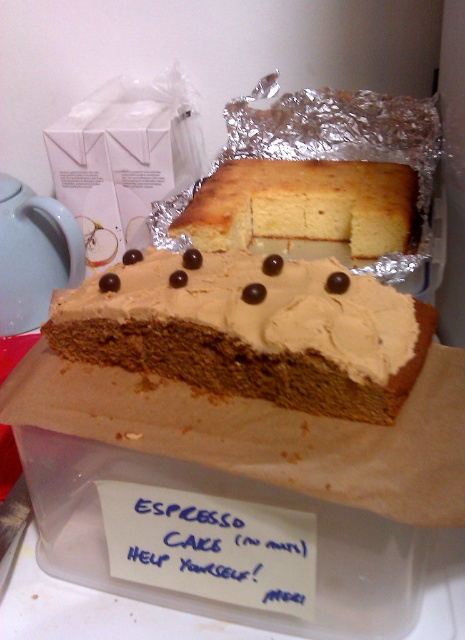
Who is positioned more to the right, brown matte cake at center or yellow sponge cake at center?

yellow sponge cake at center is more to the right.

Which is behind, point (387, 364) or point (407, 186)?

Positioned behind is point (407, 186).

What do you see at coordinates (252, 330) in the screenshot? The image size is (465, 640). I see `brown matte cake at center` at bounding box center [252, 330].

At what (x,y) coordinates should I click in order to perform the action: click on brown matte cake at center. Please return your answer as a coordinate pair (x, y). Looking at the image, I should click on (252, 330).

Who is more forward, (x=405, y=243) or (x=4, y=273)?

Point (x=405, y=243) is in front.

Does yellow sponge cake at center have a greater height compared to matte white teapot at left?

No.

Is point (411, 184) closer to camera compared to point (45, 205)?

That is True.

Identify the location of yellow sponge cake at center. This screenshot has width=465, height=640. (303, 205).

Can you confirm if brown matte cake at center is positioned to the left of matte white teapot at left?

No, brown matte cake at center is not to the left of matte white teapot at left.

In the scene shown: Between brown matte cake at center and matte white teapot at left, which one is positioned higher?

matte white teapot at left is above.

The width and height of the screenshot is (465, 640). What do you see at coordinates (252, 330) in the screenshot?
I see `brown matte cake at center` at bounding box center [252, 330].

Find the location of `brown matte cake at center`. brown matte cake at center is located at coordinates (252, 330).